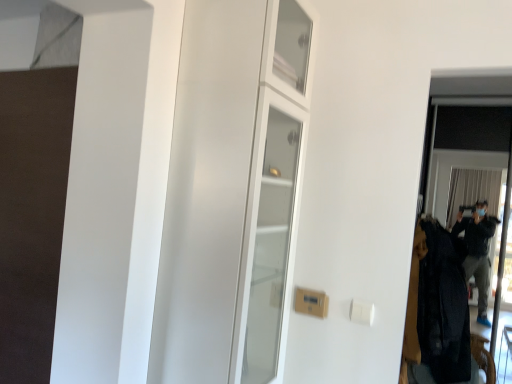
Question: Would you say transparent glass screen door at right is outside white glossy cabinet at center?

Choices:
 (A) yes
 (B) no

Answer: (A)

Question: From the image's perspective, is transparent glass screen door at right on top of white glossy cabinet at center?

Choices:
 (A) no
 (B) yes

Answer: (A)

Question: Is transparent glass screen door at right further to the viewer compared to white glossy cabinet at center?

Choices:
 (A) no
 (B) yes

Answer: (B)

Question: Are transparent glass screen door at right and white glossy cabinet at center located far from each other?

Choices:
 (A) yes
 (B) no

Answer: (A)

Question: Is transparent glass screen door at right thinner than white glossy cabinet at center?

Choices:
 (A) no
 (B) yes

Answer: (B)

Question: Is transparent glass screen door at right shorter than white glossy cabinet at center?

Choices:
 (A) no
 (B) yes

Answer: (A)

Question: Can you confirm if white glossy cabinet at center is shorter than dark woolen coat at right?

Choices:
 (A) yes
 (B) no

Answer: (B)

Question: Can you confirm if white glossy cabinet at center is positioned to the right of dark woolen coat at right?

Choices:
 (A) no
 (B) yes

Answer: (A)

Question: Is the surface of white glossy cabinet at center in direct contact with dark woolen coat at right?

Choices:
 (A) yes
 (B) no

Answer: (B)

Question: From the image's perspective, is white glossy cabinet at center over dark woolen coat at right?

Choices:
 (A) no
 (B) yes

Answer: (B)

Question: Can you confirm if white glossy cabinet at center is positioned to the left of dark woolen coat at right?

Choices:
 (A) no
 (B) yes

Answer: (B)

Question: Can you confirm if white glossy cabinet at center is bigger than dark woolen coat at right?

Choices:
 (A) yes
 (B) no

Answer: (B)

Question: Is transparent glass screen door at right at the left side of dark woolen coat at right?

Choices:
 (A) no
 (B) yes

Answer: (A)